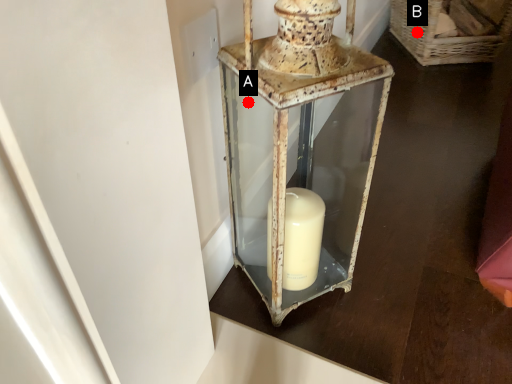
Question: Two points are circled on the image, labeled by A and B beside each circle. Which point appears farthest from the camera in this image?

Choices:
 (A) A is further
 (B) B is further

Answer: (B)